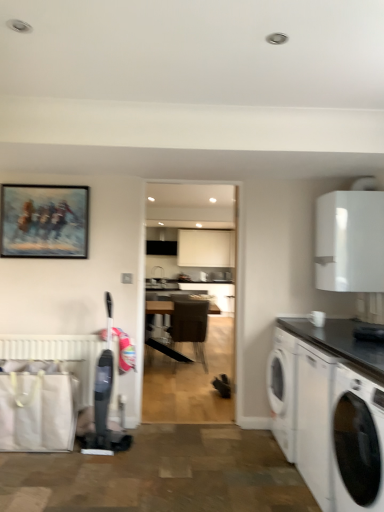
This screenshot has width=384, height=512. In order to click on black glossy countertop at lower right in this screenshot , I will do coord(330,411).

Based on the photo, measure the distance between point (329, 224) and camera.

A distance of 10.32 feet exists between point (329, 224) and camera.

What do you see at coordinates (358, 441) in the screenshot?
I see `white glossy washing machine at lower right` at bounding box center [358, 441].

What do you see at coordinates (59, 355) in the screenshot? This screenshot has width=384, height=512. I see `white matte radiator at lower left` at bounding box center [59, 355].

Identify the location of black granite countertop at right. (339, 342).

From the image's perspective, which is below, oil painting at upper left or dark brown leather chair at center?

dark brown leather chair at center.

Which of these two, oil painting at upper left or dark brown leather chair at center, stands shorter?

oil painting at upper left.

Is oil painting at upper left next to dark brown leather chair at center?

There is a gap between oil painting at upper left and dark brown leather chair at center.

From a real-world perspective, is oil painting at upper left located beneath dark brown leather chair at center?

No.

Are oil painting at upper left and white matte cabinet at upper right far apart?

oil painting at upper left is positioned a significant distance from white matte cabinet at upper right.

Considering the sizes of objects oil painting at upper left and white matte cabinet at upper right in the image provided, who is wider, oil painting at upper left or white matte cabinet at upper right?

white matte cabinet at upper right is wider.

From a real-world perspective, is oil painting at upper left below white matte cabinet at upper right?

No, from a real-world perspective, oil painting at upper left is not beneath white matte cabinet at upper right.

From the image's perspective, between oil painting at upper left and white matte cabinet at upper right, who is located below?

white matte cabinet at upper right is shown below in the image.

Is white matte cabinet at upper right at the back of black glossy countertop at lower right?

black glossy countertop at lower right does not have its back to white matte cabinet at upper right.

Is black glossy countertop at lower right inside or outside of white matte cabinet at upper right?

black glossy countertop at lower right is not enclosed by white matte cabinet at upper right.

Considering the sizes of objects black glossy countertop at lower right and white matte cabinet at upper right in the image provided, who is thinner, black glossy countertop at lower right or white matte cabinet at upper right?

Thinner between the two is white matte cabinet at upper right.

From the picture: Which object is closer to the camera taking this photo, black glossy countertop at lower right or white matte cabinet at upper right?

Positioned in front is black glossy countertop at lower right.

Is white glossy washing machine at lower right positioned before oil painting at upper left?

Yes, white glossy washing machine at lower right is in front of oil painting at upper left.

From a real-world perspective, who is located lower, white glossy washing machine at lower right or oil painting at upper left?

white glossy washing machine at lower right.

Looking at this image, considering the relative sizes of white glossy washing machine at lower right and oil painting at upper left in the image provided, is white glossy washing machine at lower right shorter than oil painting at upper left?

No.

Considering the relative sizes of black glossy countertop at lower right and white matte radiator at lower left in the image provided, is black glossy countertop at lower right smaller than white matte radiator at lower left?

No.

In the scene shown: Can you confirm if black glossy countertop at lower right is shorter than white matte radiator at lower left?

No.

Looking at their sizes, would you say black glossy countertop at lower right is wider or thinner than white matte radiator at lower left?

Clearly, black glossy countertop at lower right has more width compared to white matte radiator at lower left.

Is point (357, 407) farther from viewer compared to point (35, 350)?

No, it is in front of (35, 350).

From the image's perspective, is white matte radiator at lower left below dark brown leather chair at center?

Actually, white matte radiator at lower left appears above dark brown leather chair at center in the image.

Can you confirm if white matte radiator at lower left is taller than dark brown leather chair at center?

No, white matte radiator at lower left is not taller than dark brown leather chair at center.

Looking at the image, does white matte radiator at lower left seem bigger or smaller compared to dark brown leather chair at center?

In the image, white matte radiator at lower left appears to be smaller than dark brown leather chair at center.

Which is less distant, (x=98, y=339) or (x=201, y=318)?

Point (x=98, y=339).

Is dark brown leather chair at center located outside oil painting at upper left?

Yes.

Based on the photo, how much distance is there between dark brown leather chair at center and oil painting at upper left?

The distance of dark brown leather chair at center from oil painting at upper left is 9.27 feet.

Is dark brown leather chair at center next to oil painting at upper left and touching it?

dark brown leather chair at center is not next to oil painting at upper left, and they're not touching.

Between dark brown leather chair at center and oil painting at upper left, which one has larger size?

dark brown leather chair at center is bigger.

The width and height of the screenshot is (384, 512). What are the coordinates of `chair below the oil painting at upper left (from the image's perspective)` in the screenshot? It's located at (190, 324).

I want to click on picture frame above the white matte cabinet at upper right (from a real-world perspective), so click(x=44, y=221).

Which object lies further to the anchor point white matte cabinet at upper right, dark brown leather chair at center or white matte radiator at lower left?

dark brown leather chair at center is positioned further to the anchor white matte cabinet at upper right.

Based on their spatial positions, is dark brown leather chair at center or black glossy countertop at lower right further from white matte radiator at lower left?

Based on the image, dark brown leather chair at center appears to be further to white matte radiator at lower left.

Considering their positions, is black glossy countertop at lower right positioned further to white matte cabinet at upper right than white glossy washing machine at lower right?

Based on the image, white glossy washing machine at lower right appears to be further to white matte cabinet at upper right.

Estimate the real-world distances between objects in this image. Which object is further from white matte radiator at lower left, oil painting at upper left or black glossy countertop at lower right?

black glossy countertop at lower right lies further to white matte radiator at lower left than the other object.

Based on their spatial positions, is white glossy washing machine at lower right or white matte radiator at lower left closer to black glossy countertop at lower right?

Among the two, white glossy washing machine at lower right is located nearer to black glossy countertop at lower right.

Which object lies further to the anchor point oil painting at upper left, black granite countertop at right or white glossy washing machine at lower right?

white glossy washing machine at lower right lies further to oil painting at upper left than the other object.

Based on their spatial positions, is white glossy washing machine at lower right or white matte cabinet at upper right closer to white matte radiator at lower left?

white matte cabinet at upper right.

Estimate the real-world distances between objects in this image. Which object is further from white matte cabinet at upper right, white glossy washing machine at lower right or oil painting at upper left?

oil painting at upper left.

Image resolution: width=384 pixels, height=512 pixels. In order to click on cabinetry positioned between black granite countertop at right and dark brown leather chair at center from near to far in this screenshot , I will do `click(350, 241)`.

At what (x,y) coordinates should I click in order to perform the action: click on counter between white glossy washing machine at lower right and dark brown leather chair at center from front to back. Please return your answer as a coordinate pair (x, y). The image size is (384, 512). Looking at the image, I should click on (330, 411).

This screenshot has width=384, height=512. Identify the location of washing machine situated between oil painting at upper left and white matte cabinet at upper right from left to right. (358, 441).

At what (x,y) coordinates should I click in order to perform the action: click on radiator between oil painting at upper left and white glossy washing machine at lower right in the horizontal direction. Please return your answer as a coordinate pair (x, y). This screenshot has width=384, height=512. Looking at the image, I should click on (59, 355).